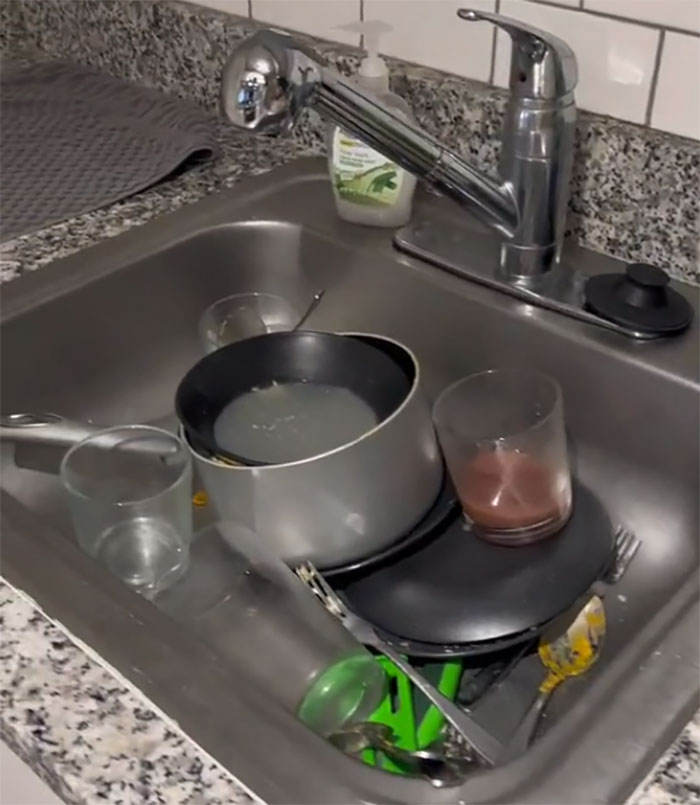
At what (x,y) coordinates should I click in order to perform the action: click on faucet. Please return your answer as a coordinate pair (x, y). Looking at the image, I should click on point(284,97).